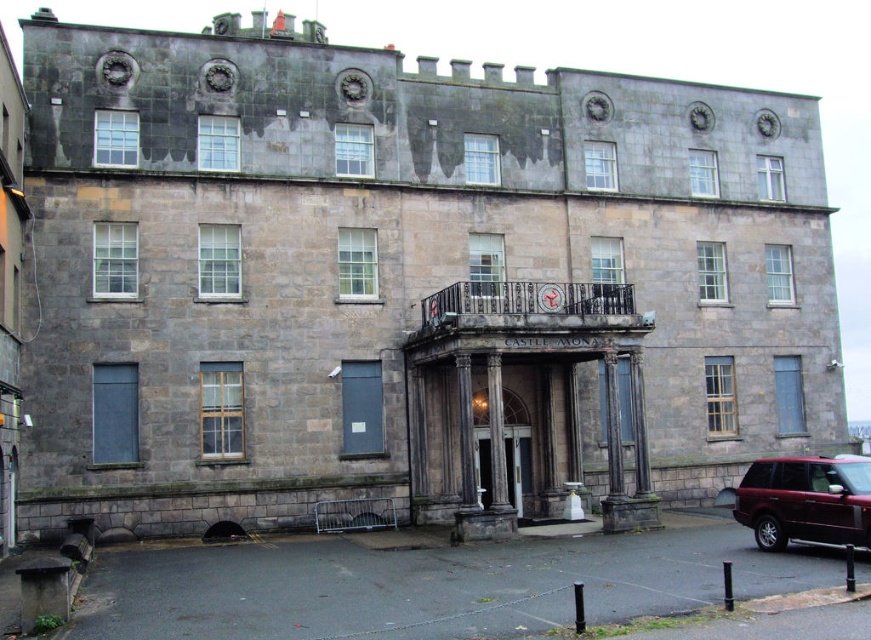
You are standing in front of the Castle Mouna building and want to park your shiny maroon suv at lower right as close as possible to the polished stone door at center without blocking the entrance. Based on their positions, can you park the suv at lower right directly in front of the door at center?

The shiny maroon suv at lower right is closer to the viewer than the polished stone door at center, so parking it directly in front would place it between you and the door, potentially blocking the entrance. Choose a spot further back to avoid obstruction.

You are a driver approaching the polished stone door at center. You have a shiny maroon suv at lower right. Can your vehicle pass through the door? Please explain your reasoning.

The shiny maroon suv at lower right is wider than the polished stone door at center, so it cannot pass through the door.